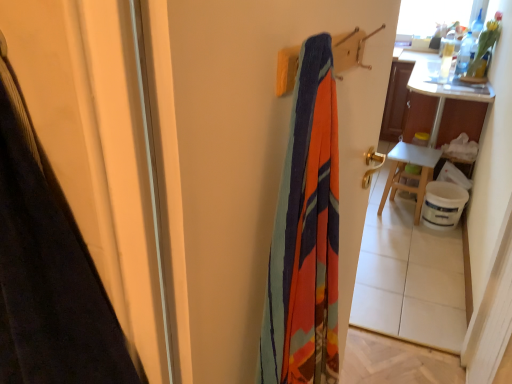
Identify the location of free spot above white wooden table at right (from a real-world perspective). This screenshot has height=384, width=512. (410, 152).